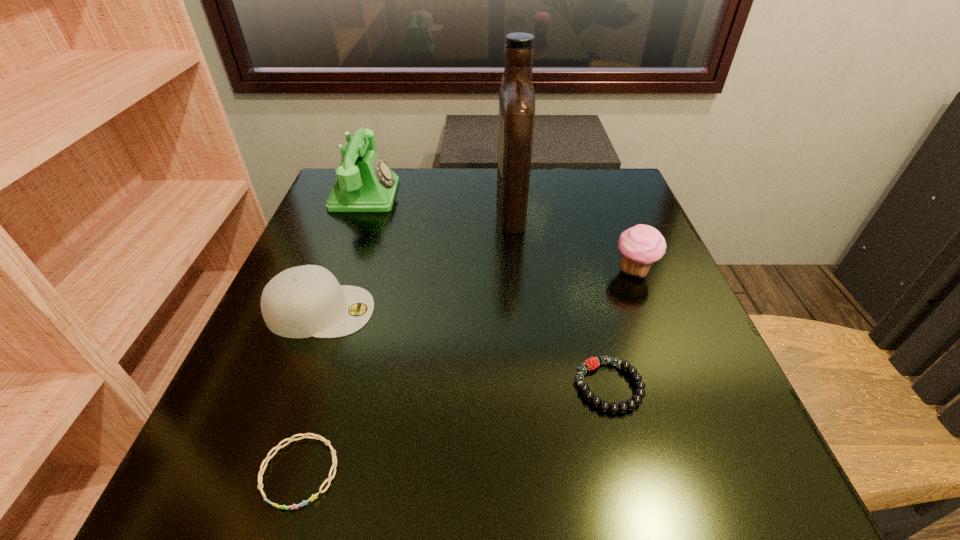
Locate an element on the screen. object situated at the near edge is located at coordinates (260, 475).

Identify the location of telephone present at the left edge. This screenshot has height=540, width=960. (364, 183).

This screenshot has height=540, width=960. What are the coordinates of `cap that is at the left edge` in the screenshot? It's located at (303, 301).

The width and height of the screenshot is (960, 540). Find the location of `bracelet at the left edge`. bracelet at the left edge is located at coordinates (260, 475).

The image size is (960, 540). I want to click on cupcake that is at the right edge, so click(x=641, y=245).

Locate an element on the screen. The image size is (960, 540). bracelet that is at the right edge is located at coordinates (592, 363).

Locate an element on the screen. The width and height of the screenshot is (960, 540). object at the far left corner is located at coordinates (364, 183).

Locate an element on the screen. The width and height of the screenshot is (960, 540). object that is positioned at the near left corner is located at coordinates tap(260, 475).

Find the location of a particular element. Image resolution: width=960 pixels, height=540 pixels. vacant space at the far edge is located at coordinates (469, 186).

Identify the location of vacant space at the near edge. (360, 474).